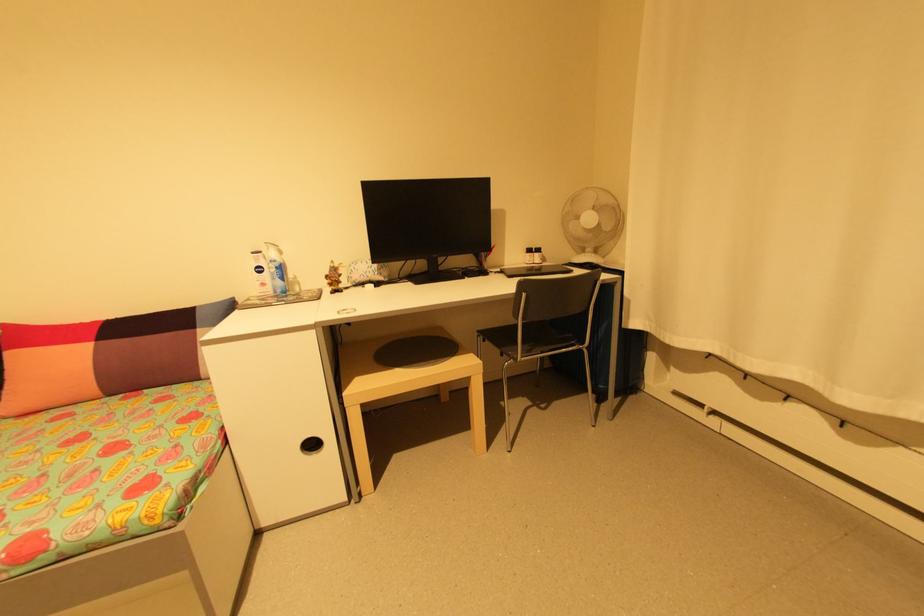
At what (x,y) coordinates should I click in order to perform the action: click on spray bottle trigger. Please return your answer as a coordinate pair (x, y). The height and width of the screenshot is (616, 924). Looking at the image, I should click on (334, 277).